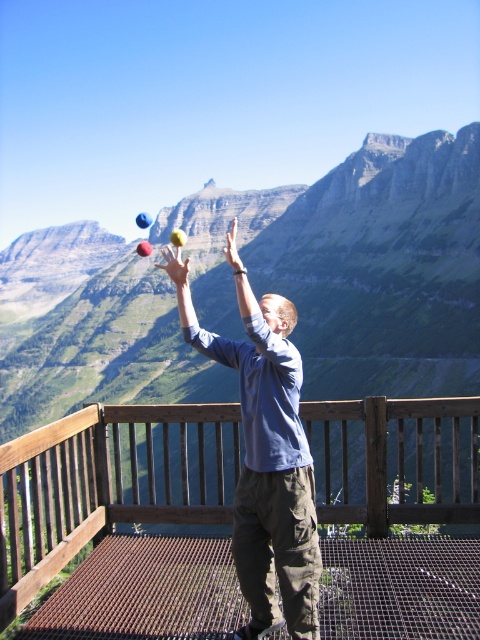
Measure the distance between point [244,545] and camera.

Point [244,545] and camera are 22.04 meters apart from each other.

Who is shorter, blue fabric shirt at center or rubber ball at upper center?

blue fabric shirt at center is shorter.

Does point (217, 352) come behind point (143, 221)?

No.

The height and width of the screenshot is (640, 480). Find the location of `blue fabric shirt at center`. blue fabric shirt at center is located at coordinates (264, 454).

Does brown wooden balustrade at center lie behind blue fabric shirt at center?

That is True.

Between brown wooden balustrade at center and blue fabric shirt at center, which one appears on the left side from the viewer's perspective?

Positioned to the left is blue fabric shirt at center.

Image resolution: width=480 pixels, height=640 pixels. In order to click on brown wooden balustrade at center in this screenshot , I will do tap(108, 483).

Locate an element on the screen. The height and width of the screenshot is (640, 480). brown wooden balustrade at center is located at coordinates (108, 483).

Does green grassy mountain at upper center have a smaller size compared to rubber ball at upper center?

Actually, green grassy mountain at upper center might be larger than rubber ball at upper center.

Who is lower down, green grassy mountain at upper center or rubber ball at upper center?

green grassy mountain at upper center is below.

This screenshot has height=640, width=480. In order to click on green grassy mountain at upper center in this screenshot , I will do `click(359, 264)`.